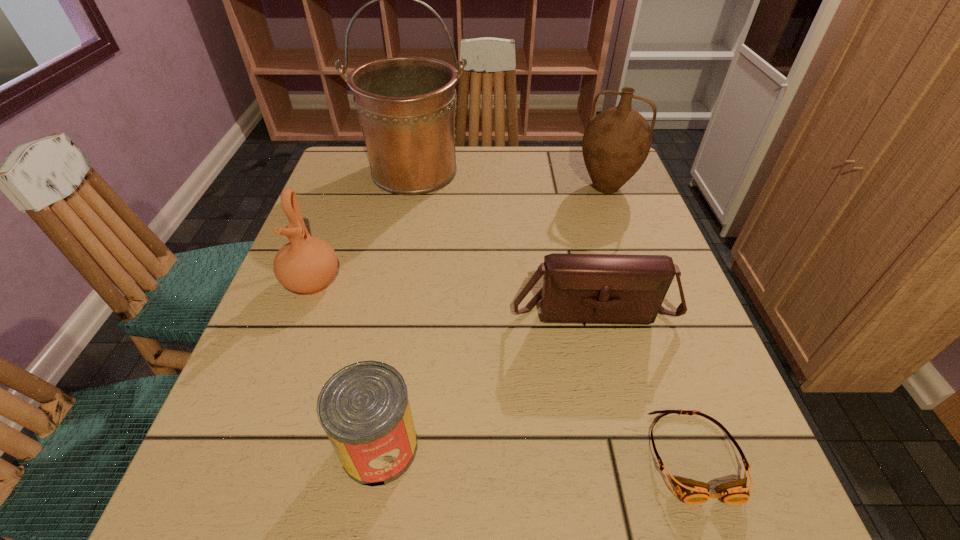
Identify the location of free space between the can and the third tallest object. (347, 364).

Find the location of a particular element. The height and width of the screenshot is (540, 960). vacant point located between the can and the pitcher is located at coordinates (492, 317).

Where is `vacant space in between the shoulder bag and the shortest object`? vacant space in between the shoulder bag and the shortest object is located at coordinates (643, 382).

Where is `vacant area that lies between the bucket and the pottery`? This screenshot has width=960, height=540. vacant area that lies between the bucket and the pottery is located at coordinates (364, 227).

The image size is (960, 540). In order to click on unoccupied area between the shoulder bag and the bucket in this screenshot , I will do `click(504, 240)`.

I want to click on free spot between the third tallest object and the shortest object, so click(x=503, y=369).

At what (x,y) coordinates should I click in order to perform the action: click on blank region between the fourth shortest object and the can. Please return your answer as a coordinate pair (x, y). This screenshot has height=540, width=960. Looking at the image, I should click on (347, 364).

The image size is (960, 540). I want to click on the third closest object to the goggles, so click(616, 142).

Identify which object is the second closest to the can. Please provide its 2D coordinates. Your answer should be formatted as a tuple, i.e. [(x, y)], where the tuple contains the x and y coordinates of a point satisfying the conditions above.

[(306, 265)]

Where is `free space that satisfies the following two spatial constraints: 1. on the front side of the bucket; 2. on the left side of the pitcher`? free space that satisfies the following two spatial constraints: 1. on the front side of the bucket; 2. on the left side of the pitcher is located at coordinates (411, 187).